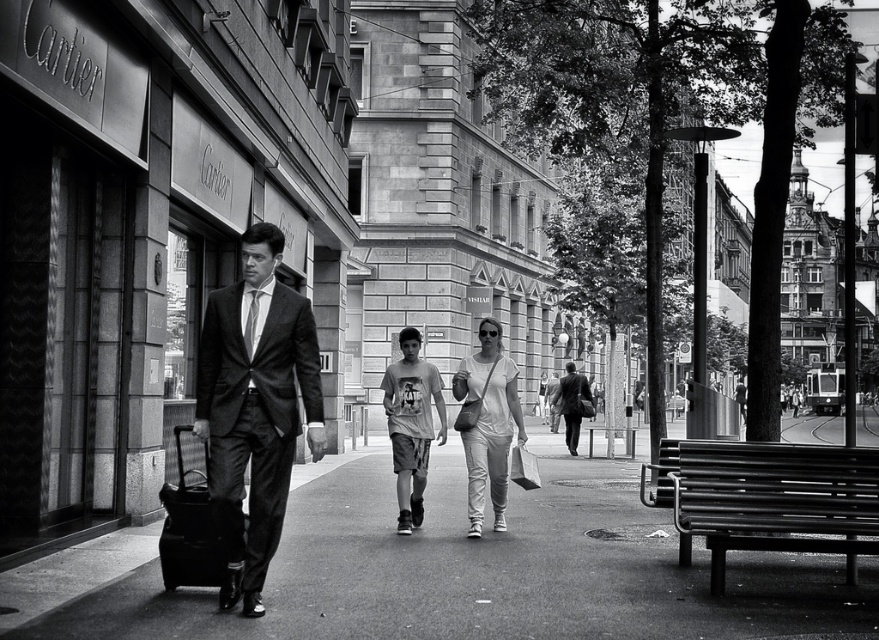
Can you confirm if smooth asphalt pavement at center is bigger than dark gray suit at center?

Indeed, smooth asphalt pavement at center has a larger size compared to dark gray suit at center.

Is the position of smooth asphalt pavement at center less distant than that of dark gray suit at center?

Yes, smooth asphalt pavement at center is in front of dark gray suit at center.

Who is more distant from viewer, (480, 544) or (218, 483)?

Positioned behind is point (480, 544).

Where is `smooth asphalt pavement at center`? This screenshot has height=640, width=879. smooth asphalt pavement at center is located at coordinates [451, 570].

Does point (243, 330) come behind point (415, 477)?

No.

Between dark gray suit at center and light gray t-shirt at center, which one has less height?

light gray t-shirt at center

Is point (274, 316) in front of point (418, 435)?

Yes, point (274, 316) is closer to viewer.

Locate an element on the screen. The image size is (879, 640). dark gray suit at center is located at coordinates (255, 406).

Between dark gray suit at center and matte black suit at center, which one is positioned lower?

Positioned lower is matte black suit at center.

Is dark gray suit at center closer to the viewer compared to matte black suit at center?

That is True.

Identify the location of dark gray suit at center. The height and width of the screenshot is (640, 879). (255, 406).